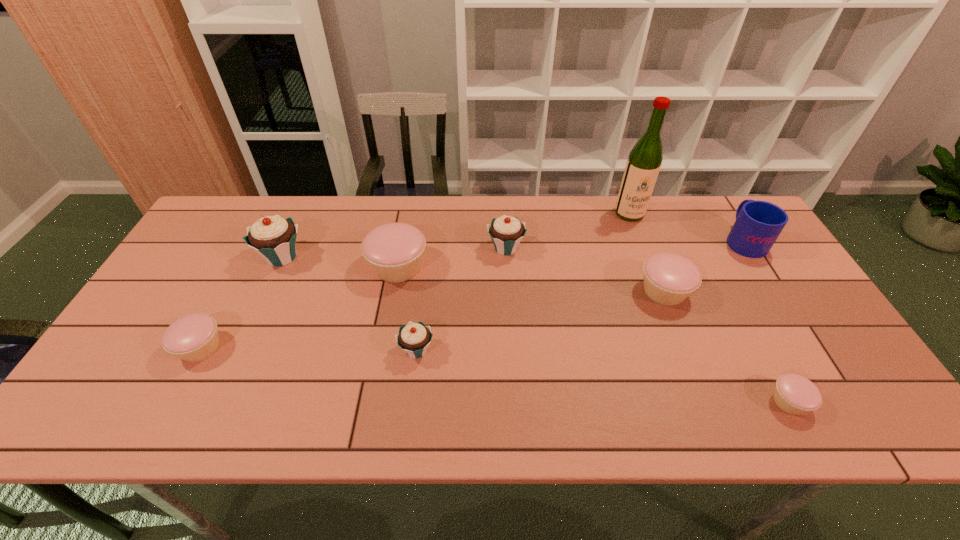
Identify the location of green liquor. (643, 165).

The image size is (960, 540). I want to click on the farthest object, so click(x=643, y=165).

In order to click on the leftmost teal cupcake in this screenshot , I will do `click(273, 237)`.

Find the location of a particular element. Image resolution: width=960 pixels, height=540 pixels. the tallest cupcake is located at coordinates (273, 237).

You are a GUI agent. You are given a task and a screenshot of the screen. Output one action in this format:
    pyautogui.click(x=<x>, y=<y>)
    Task: Click on the rightmost object
    
    Given the screenshot: What is the action you would take?
    pyautogui.click(x=758, y=224)

At what (x,y) coordinates should I click in order to perform the action: click on mug. Please return your answer as a coordinate pair (x, y). Looking at the image, I should click on (758, 224).

Image resolution: width=960 pixels, height=540 pixels. I want to click on the fifth object from left to right, so click(x=506, y=232).

The image size is (960, 540). In order to click on the second smallest teal cupcake in this screenshot , I will do `click(506, 232)`.

You are a GUI agent. You are given a task and a screenshot of the screen. Output one action in this format:
    pyautogui.click(x=<x>, y=<y>)
    Task: Click on the second pink cupcake from left to right
    
    Given the screenshot: What is the action you would take?
    pyautogui.click(x=394, y=251)

I want to click on the second pink cupcake from right to left, so coord(669,278).